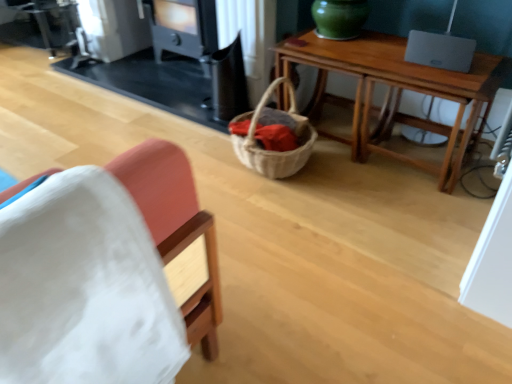
Question: Does white fabric chair at left have a smaller size compared to black matte fireplace at upper center?

Choices:
 (A) yes
 (B) no

Answer: (A)

Question: From a real-world perspective, is white fabric chair at left located higher than black matte fireplace at upper center?

Choices:
 (A) no
 (B) yes

Answer: (B)

Question: Is white fabric chair at left next to black matte fireplace at upper center?

Choices:
 (A) no
 (B) yes

Answer: (A)

Question: Is white fabric chair at left outside black matte fireplace at upper center?

Choices:
 (A) no
 (B) yes

Answer: (B)

Question: From a real-world perspective, is white fabric chair at left below black matte fireplace at upper center?

Choices:
 (A) no
 (B) yes

Answer: (A)

Question: Is wooden table at center inside the boundaries of black matte fireplace at upper center, or outside?

Choices:
 (A) outside
 (B) inside

Answer: (A)

Question: From a real-world perspective, is wooden table at center physically located above or below black matte fireplace at upper center?

Choices:
 (A) above
 (B) below

Answer: (B)

Question: Considering the positions of wooden table at center and black matte fireplace at upper center in the image, is wooden table at center bigger or smaller than black matte fireplace at upper center?

Choices:
 (A) big
 (B) small

Answer: (B)

Question: In terms of width, does wooden table at center look wider or thinner when compared to black matte fireplace at upper center?

Choices:
 (A) wide
 (B) thin

Answer: (B)

Question: Is black matte stove at upper center bigger or smaller than wooden table at center?

Choices:
 (A) small
 (B) big

Answer: (A)

Question: From the image's perspective, is black matte stove at upper center positioned above or below wooden table at center?

Choices:
 (A) below
 (B) above

Answer: (B)

Question: In the image, is black matte stove at upper center on the left side or the right side of wooden table at center?

Choices:
 (A) left
 (B) right

Answer: (A)

Question: From a real-world perspective, is black matte stove at upper center positioned above or below wooden table at center?

Choices:
 (A) below
 (B) above

Answer: (B)

Question: Considering their positions, is black matte stove at upper center located in front of or behind black matte fireplace at upper center?

Choices:
 (A) front
 (B) behind

Answer: (B)

Question: From a real-world perspective, relative to black matte fireplace at upper center, is black matte stove at upper center vertically above or below?

Choices:
 (A) below
 (B) above

Answer: (A)